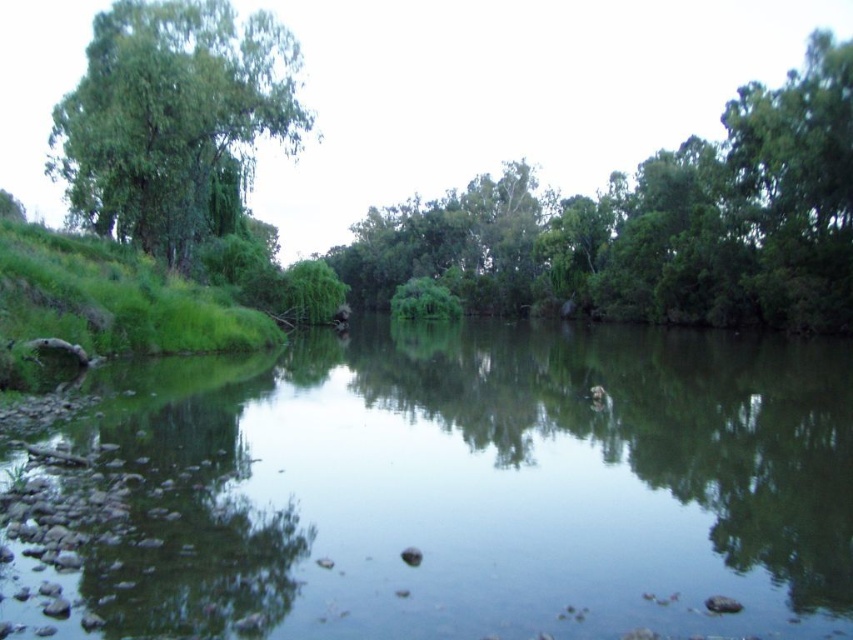
You are standing at the edge of the green leafy tree at left and want to cross to the other side of the green grassy river at center. Which direction should you head to reach the opposite bank?

Since the green grassy river at center is positioned on the right side of the green leafy tree at left, you should head to the left to reach the opposite bank.

You are standing at the edge of the water in the serene natural scene. You notice two points marked in the image. Which point, point (418, 589) or point (776, 152), is closer to you?

Point (418, 589) is closer to the viewer than point (776, 152).

You are standing at the edge of the green grassy river at center and want to look up at the green leafy tree at center. In which direction should you turn your head?

You should look up because the green leafy tree at center is above the green grassy river at center.